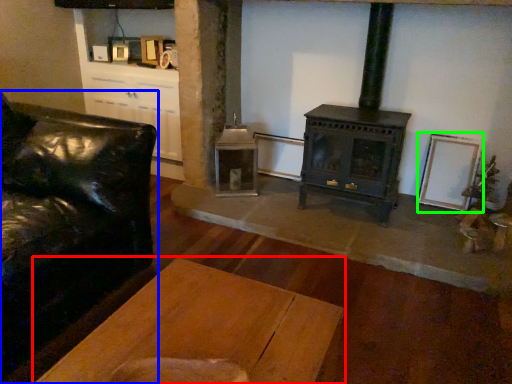
Question: Which object is positioned closest to table (highlighted by a red box)? Select from studio couch (highlighted by a blue box) and picture frame (highlighted by a green box).

Choices:
 (A) studio couch
 (B) picture frame

Answer: (A)